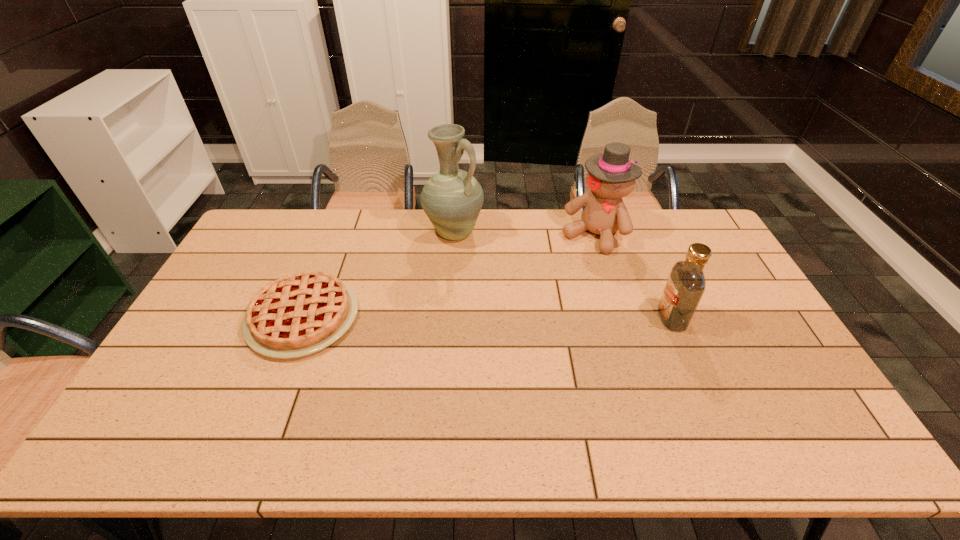
Find the location of `free space located on the front-facing side of the third tallest object`. free space located on the front-facing side of the third tallest object is located at coordinates (588, 318).

The image size is (960, 540). Find the location of `free location located on the front-facing side of the third tallest object`. free location located on the front-facing side of the third tallest object is located at coordinates (639, 318).

You are a GUI agent. You are given a task and a screenshot of the screen. Output one action in this format:
    pyautogui.click(x=<x>, y=<y>)
    Task: Click on the free space located on the handle side of the third object from right to left
    
    Given the screenshot: What is the action you would take?
    pyautogui.click(x=500, y=287)

The image size is (960, 540). I want to click on free space located 0.370m on the handle side of the third object from right to left, so click(526, 318).

This screenshot has width=960, height=540. I want to click on vacant region located on the handle side of the third object from right to left, so click(x=486, y=271).

What are the coordinates of `vacant space located 0.080m on the front-facing side of the rag_doll` in the screenshot? It's located at (570, 265).

Where is `vacant space located 0.120m on the front-facing side of the rag_doll`? Image resolution: width=960 pixels, height=540 pixels. vacant space located 0.120m on the front-facing side of the rag_doll is located at coordinates (565, 272).

Locate an element on the screen. The height and width of the screenshot is (540, 960). vacant space located 0.280m on the front-facing side of the rag_doll is located at coordinates (542, 301).

Identify the location of pitcher that is at the far edge. (452, 198).

At what (x,y) coordinates should I click in order to perform the action: click on rag_doll present at the far edge. Please return your answer as a coordinate pair (x, y). This screenshot has width=960, height=540. Looking at the image, I should click on (611, 176).